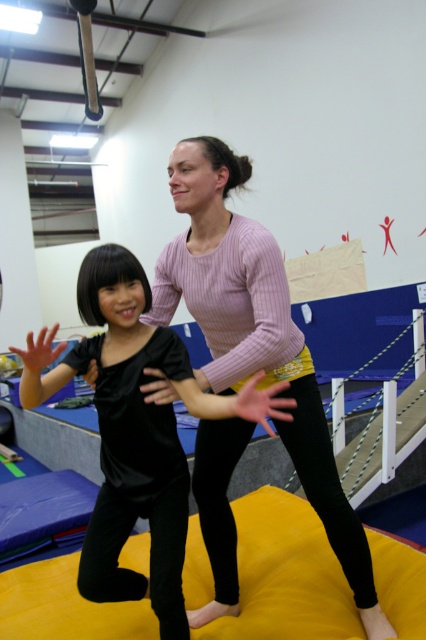
Between pink ribbed sweater at center and black velvet shirt at center, which one appears on the right side from the viewer's perspective?

From the viewer's perspective, pink ribbed sweater at center appears more on the right side.

Can you confirm if pink ribbed sweater at center is bigger than black velvet shirt at center?

Actually, pink ribbed sweater at center might be smaller than black velvet shirt at center.

Image resolution: width=426 pixels, height=640 pixels. In order to click on pink ribbed sweater at center in this screenshot , I will do `click(255, 337)`.